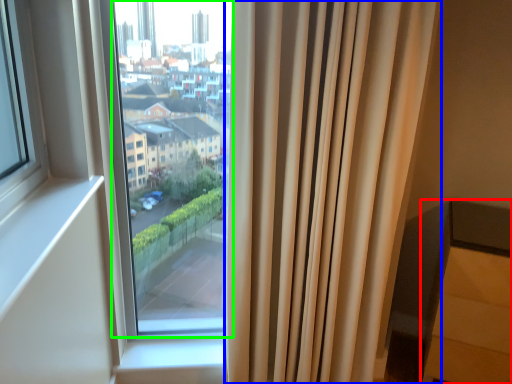
Question: Based on their relative distances, which object is nearer to furniture (highlighted by a red box)? Choose from curtain (highlighted by a blue box) and bay window (highlighted by a green box).

Choices:
 (A) curtain
 (B) bay window

Answer: (A)